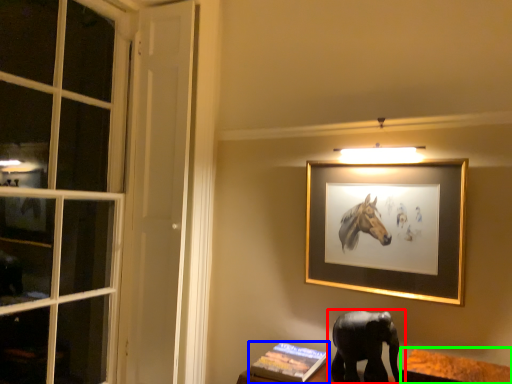
Question: Considering the real-world distances, which object is farthest from elephant (highlighted by a red box)? book (highlighted by a blue box) or table (highlighted by a green box)?

Choices:
 (A) book
 (B) table

Answer: (A)